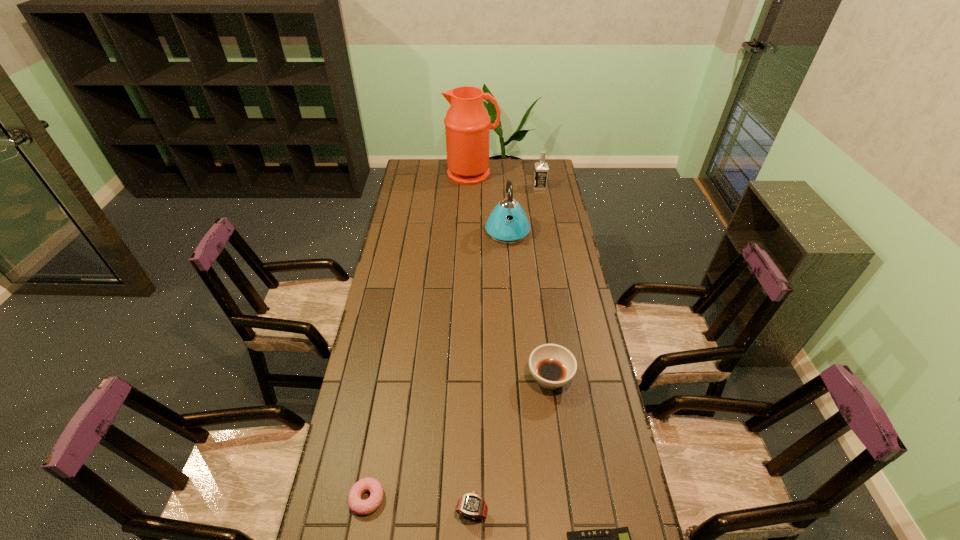
Identify the location of unoccupied area between the watch and the second tallest object. (490, 372).

This screenshot has height=540, width=960. I want to click on free point between the soup bowl and the tallest object, so click(x=511, y=276).

Choose which object is the fifth nearest neighbor to the kettle. Please provide its 2D coordinates. Your answer should be formatted as a tuple, i.e. [(x, y)], where the tuple contains the x and y coordinates of a point satisfying the conditions above.

[(471, 505)]

Identify which object is the fifth nearest to the fifth shortest object. Please provide its 2D coordinates. Your answer should be formatted as a tuple, i.e. [(x, y)], where the tuple contains the x and y coordinates of a point satisfying the conditions above.

[(362, 507)]

I want to click on free location that satisfies the following two spatial constraints: 1. at the spout of the kettle; 2. on the right side of the soup bowl, so click(x=518, y=379).

In order to click on free space that satisfies the following two spatial constraints: 1. from the spout of the watch; 2. on the left side of the water jug in this screenshot , I will do `click(464, 512)`.